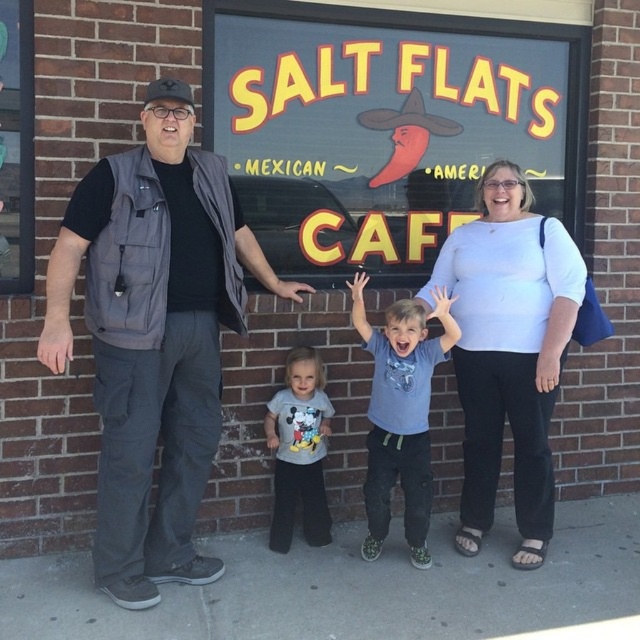
Question: Can you confirm if white cotton shirt at center is smaller than gray cotton shirt at center?

Choices:
 (A) no
 (B) yes

Answer: (A)

Question: Does yellow painted sign at center appear on the right side of gray cotton shirt at center?

Choices:
 (A) yes
 (B) no

Answer: (A)

Question: Which point is closer to the camera?

Choices:
 (A) gray cotton shirt at center
 (B) gray vest at left
 (C) yellow painted sign at center
 (D) blue cotton shirt at center

Answer: (B)

Question: Is yellow painted sign at center smaller than gray vest at left?

Choices:
 (A) yes
 (B) no

Answer: (A)

Question: Among these points, which one is nearest to the camera?

Choices:
 (A) (376, 524)
 (B) (465, 508)

Answer: (A)

Question: Which point appears closest to the camera in this image?

Choices:
 (A) (502, 333)
 (B) (392, 422)
 (C) (285, 492)

Answer: (A)